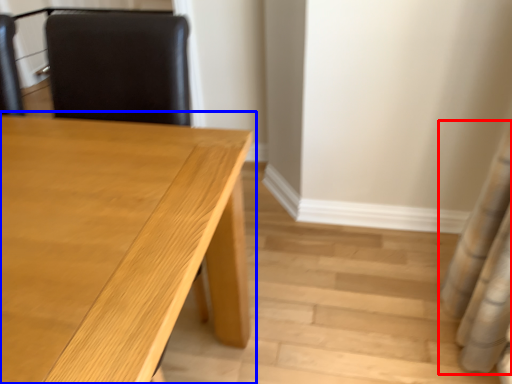
Question: Which object appears farthest to the camera in this image, shower curtain (highlighted by a red box) or table (highlighted by a blue box)?

Choices:
 (A) shower curtain
 (B) table

Answer: (A)